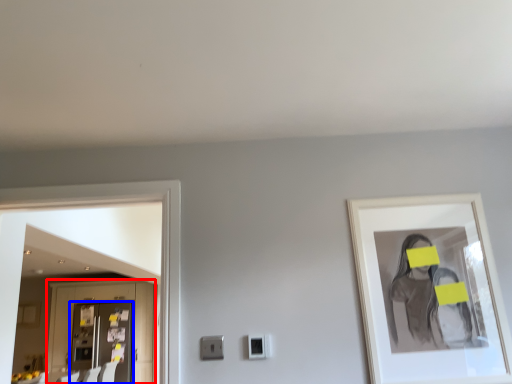
Question: Which of the following is the closest to the observer, cabinetry (highlighted by a red box) or door (highlighted by a blue box)?

Choices:
 (A) cabinetry
 (B) door

Answer: (B)